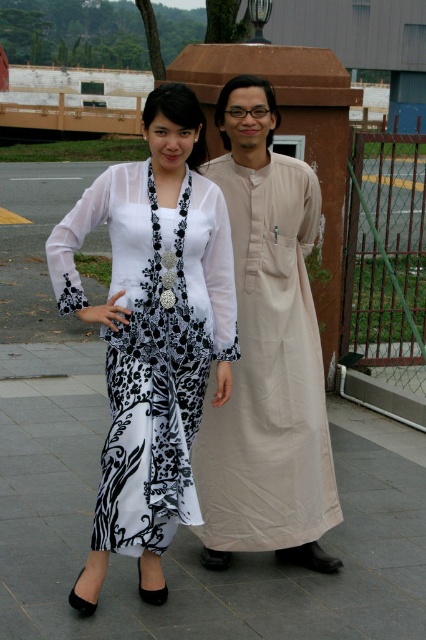
You are trying to decide which clothing item to take with you on a trip. You have limited space in your luggage. Based on the image, which clothing item between the white sheer blouse at upper left and the beige cotton robe at center would you choose to leave behind to save space?

The beige cotton robe at center is smaller than the white sheer blouse at upper left, so it takes up less space. Therefore, you should leave behind the white sheer blouse at upper left to save space.

You are a photographer setting up a shoot. You need to position a light source to the left of both the black fabric skirt at lower center and the white sheer dress at center. Is this possible given their positions?

The black fabric skirt at lower center is to the right of the white sheer dress at center, so placing a light source to the left of both is possible as they are aligned in a way that allows a single light source to be positioned to their shared left side.

You are a photographer setting up a shoot in the described outdoor area. You need to ensure that the black fabric skirt at lower center does not get in the way of the white sheer dress at center. Based on their positions, is the skirt already positioned in a way that it won, or will it interfere with the dress?

The black fabric skirt at lower center is positioned under the white sheer dress at center, so it is already placed below and would not interfere with the dress.